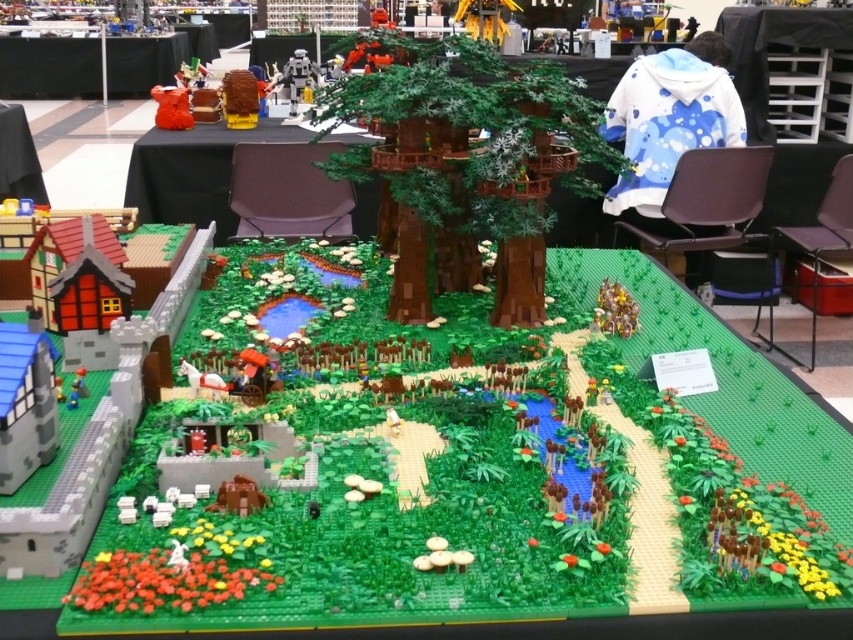
Which of these two, green matte tree at center or black plastic table at upper left, stands shorter?

green matte tree at center is shorter.

Looking at this image, between green matte tree at center and black plastic table at upper left, which one is positioned higher?

black plastic table at upper left is above.

Who is more forward, [601,156] or [154,76]?

Positioned in front is point [601,156].

At what (x,y) coordinates should I click in order to perform the action: click on green matte tree at center. Please return your answer as a coordinate pair (x, y). This screenshot has height=640, width=853. Looking at the image, I should click on (465, 164).

Who is more forward, (73, 76) or (16, 182)?

Point (16, 182) is more forward.

You are a GUI agent. You are given a task and a screenshot of the screen. Output one action in this format:
    pyautogui.click(x=<x>, y=<y>)
    Task: Click on the black plastic table at upper left
    Image resolution: width=853 pixels, height=640 pixels.
    Given the screenshot: What is the action you would take?
    pyautogui.click(x=49, y=67)

Identify the location of black plastic table at upper left. (49, 67).

Does green matte table at center appear on the right side of smooth plastic table at lower left?

Yes, green matte table at center is to the right of smooth plastic table at lower left.

Looking at this image, who is more forward, (260, 138) or (13, 168)?

Point (260, 138) is in front.

Which is behind, point (375, 182) or point (15, 161)?

Point (15, 161)

Locate an element on the screen. This screenshot has height=640, width=853. green matte table at center is located at coordinates (193, 172).